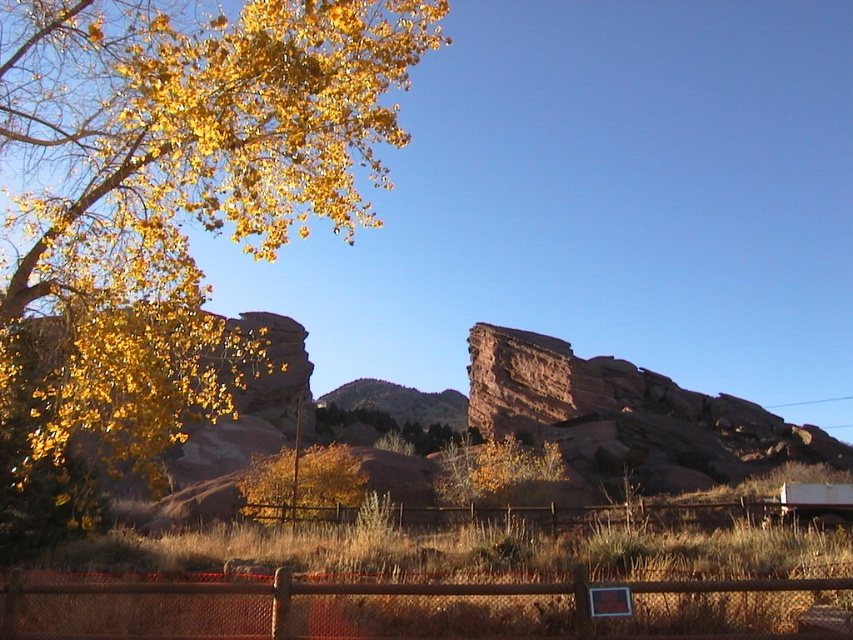
Based on the photo, you are an artist planning to sketch this landscape. You want to ensure the brown wooden fence at center and the golden leafy tree at center are proportionally accurate. Based on the scene, which object should you draw larger in your sketch?

The brown wooden fence at center should be drawn larger than the golden leafy tree at center because the brown wooden fence at center is bigger than golden leafy tree at center according to the description.

You are standing at the point marked by the coordinate point at (631, 515). What object are you directly facing?

The point at (631, 515) indicates you are directly facing the brown wooden fence at center.